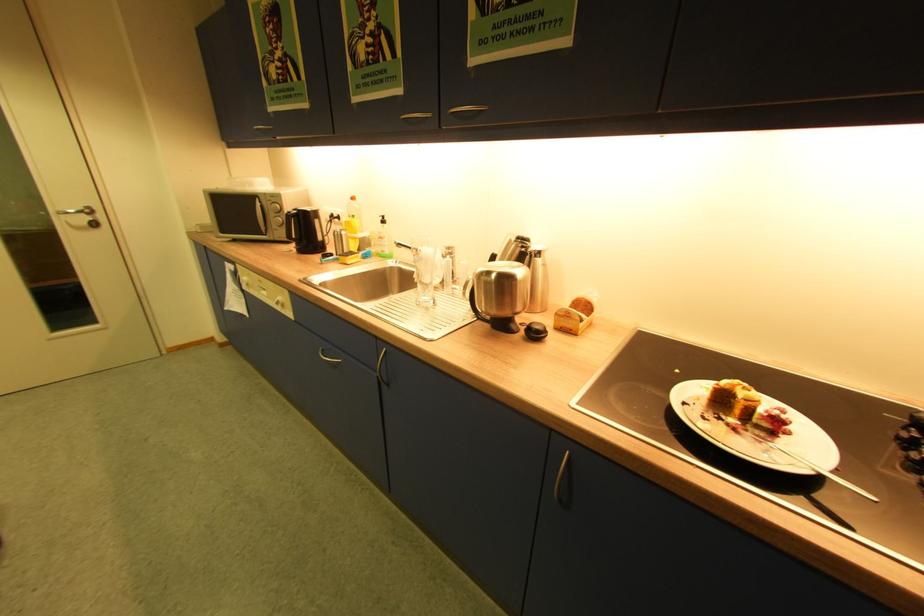
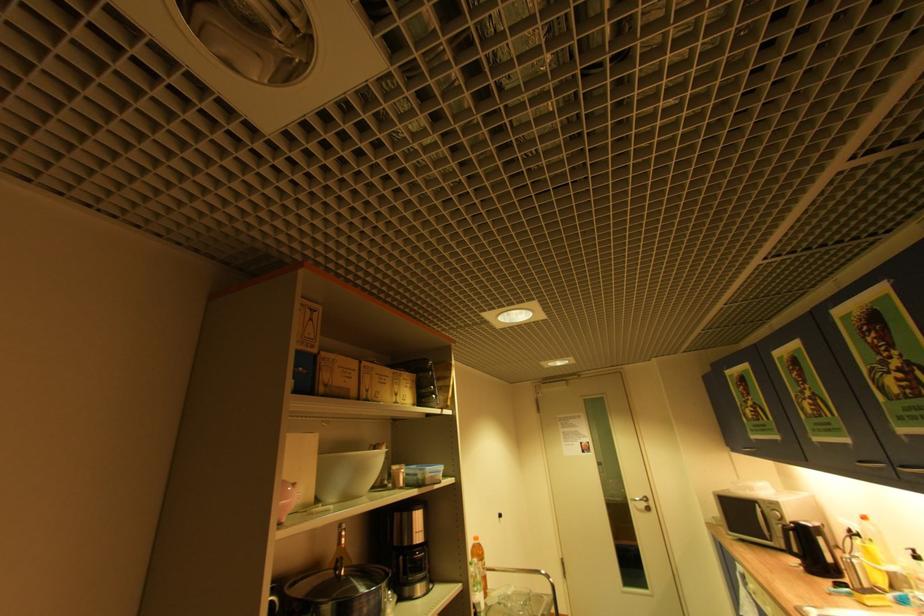
The first image is from the beginning of the video and the second image is from the end. How did the camera likely rotate when shooting the video?

The rotation direction of the camera is left-up.